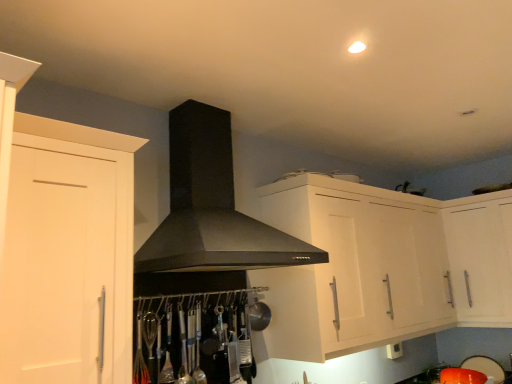
Locate an element on the screen. This screenshot has width=512, height=384. empty space that is ontop of black matte fume hood at center (from a real-world perspective) is located at coordinates [223, 90].